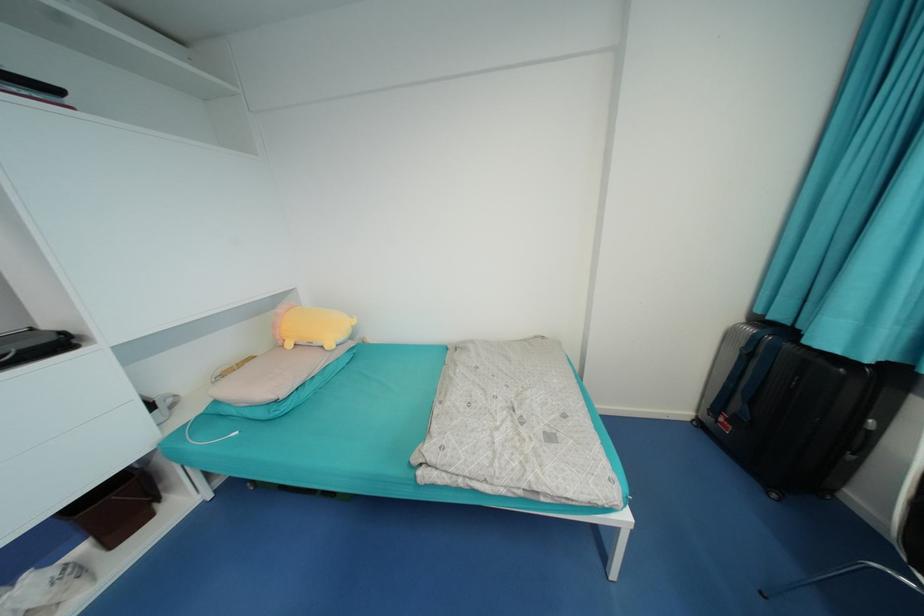
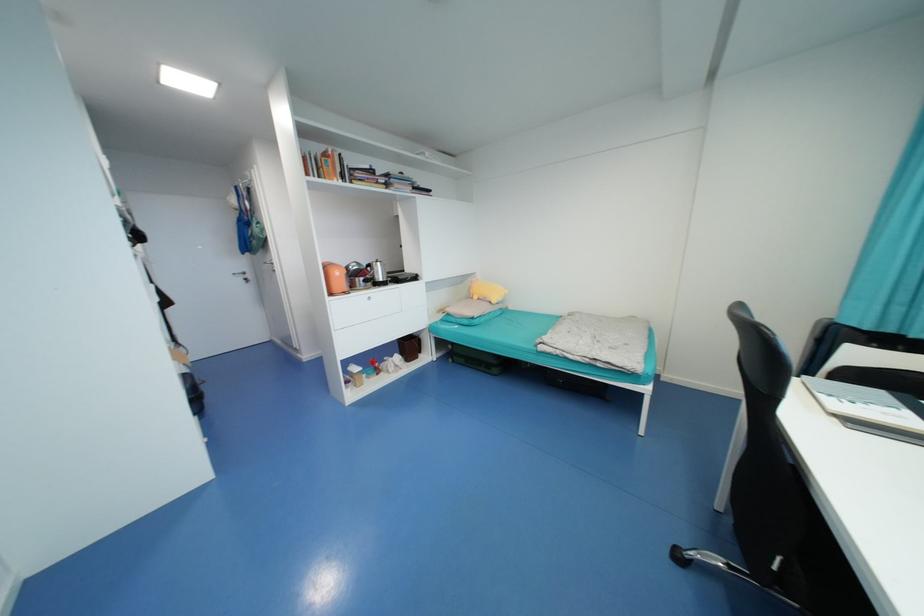
Find the pixel in the second image that matches pixel 294 346 in the first image.

(480, 299)